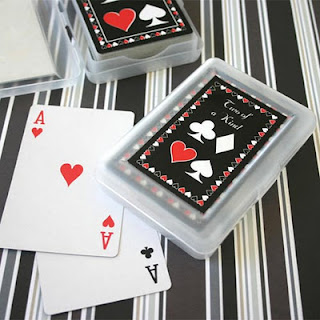
This screenshot has height=320, width=320. I want to click on plastic container, so click(x=54, y=70), click(x=178, y=224).